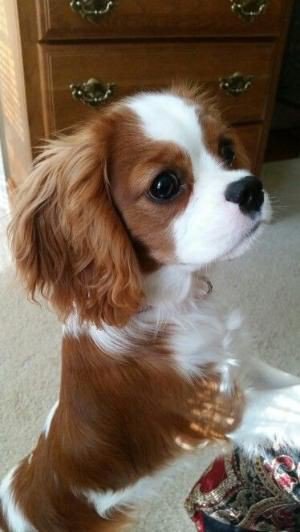
You are a GUI agent. You are given a task and a screenshot of the screen. Output one action in this format:
    pyautogui.click(x=<x>, y=<y>)
    Task: Click on the dresser front drawers
    The height and width of the screenshot is (532, 300).
    Given the screenshot: What is the action you would take?
    pyautogui.click(x=65, y=24), pyautogui.click(x=270, y=27), pyautogui.click(x=264, y=63), pyautogui.click(x=61, y=78)